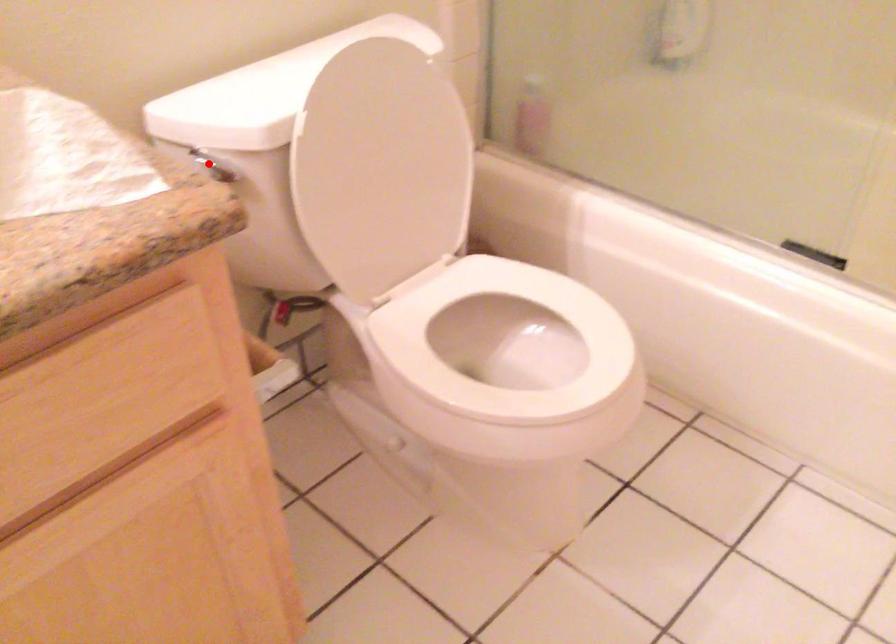
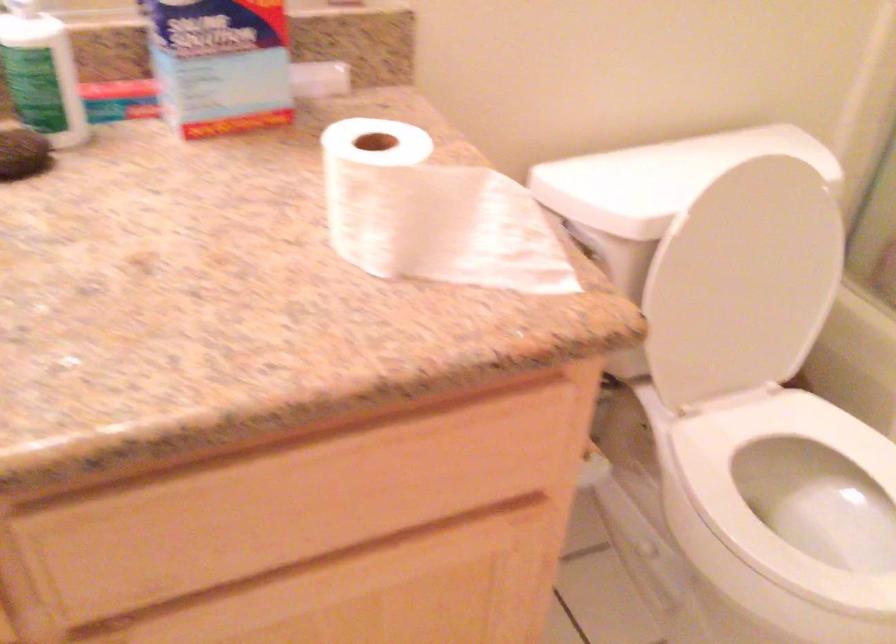
Question: I am providing you with two images of the same scene from different viewpoints. A red point is marked on the first image. At the location where the point appears in image 1, is it still visible in image 2?

Choices:
 (A) Yes
 (B) No

Answer: (B)